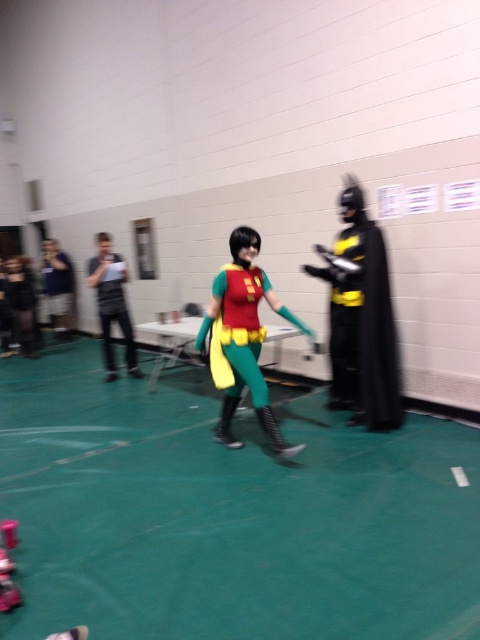
Who is lower down, matte black clipboard at left or matte black camera at left?

matte black clipboard at left

Does point (99, 316) come in front of point (46, 259)?

Yes.

The image size is (480, 640). I want to click on matte black clipboard at left, so click(x=111, y=305).

Based on the photo, can you confirm if matte green costume at center is thinner than matte black clipboard at left?

No, matte green costume at center is not thinner than matte black clipboard at left.

I want to click on matte green costume at center, so tap(242, 339).

This screenshot has height=640, width=480. What are the coordinates of `matte green costume at center` in the screenshot? It's located at (242, 339).

You are a GUI agent. You are given a task and a screenshot of the screen. Output one action in this format:
    pyautogui.click(x=<x>, y=<y>)
    Task: Click on the matte green costume at center
    
    Given the screenshot: What is the action you would take?
    pyautogui.click(x=242, y=339)

Is black matte batman costume at right to the left of matte black camera at left from the viewer's perspective?

No, black matte batman costume at right is not to the left of matte black camera at left.

Is black matte batman costume at right shorter than matte black camera at left?

Incorrect, black matte batman costume at right's height does not fall short of matte black camera at left's.

Find the location of `black matte batman costume at right`. black matte batman costume at right is located at coordinates (360, 317).